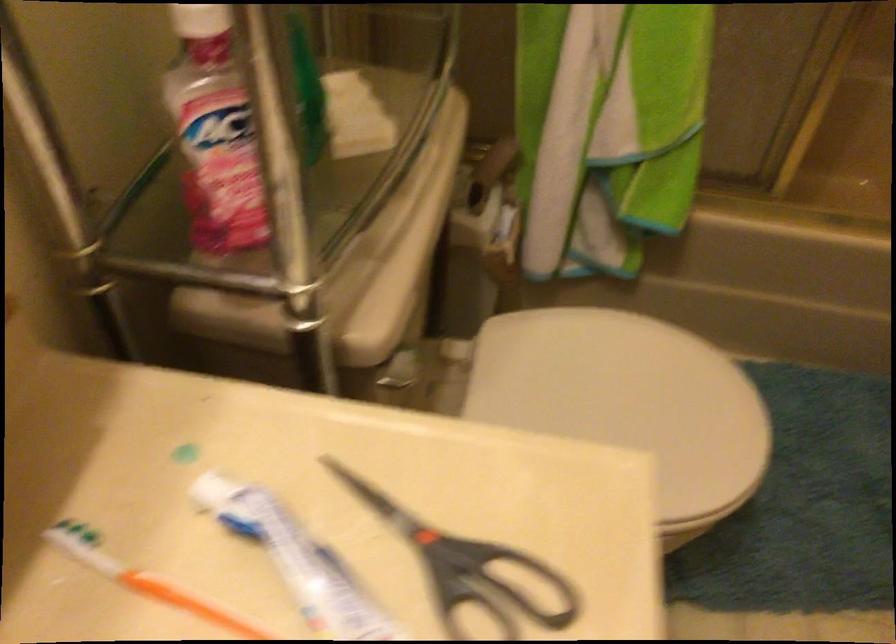
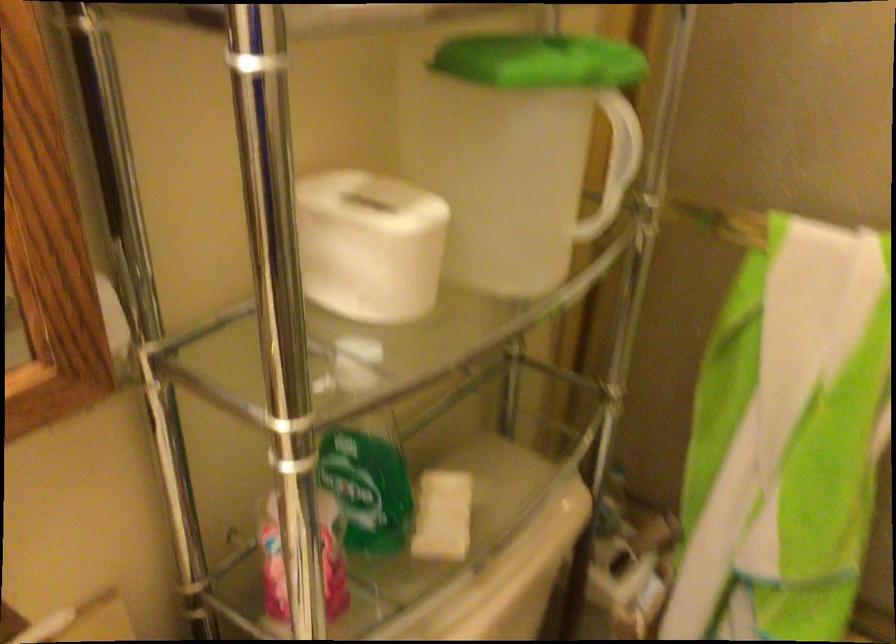
The point at (348, 116) is marked in the first image. Where is the corresponding point in the second image?

(442, 516)